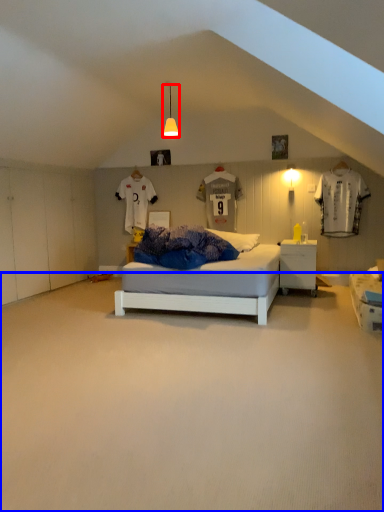
Question: Which object appears closest to the camera in this image, light fixture (highlighted by a red box) or plain (highlighted by a blue box)?

Choices:
 (A) light fixture
 (B) plain

Answer: (B)